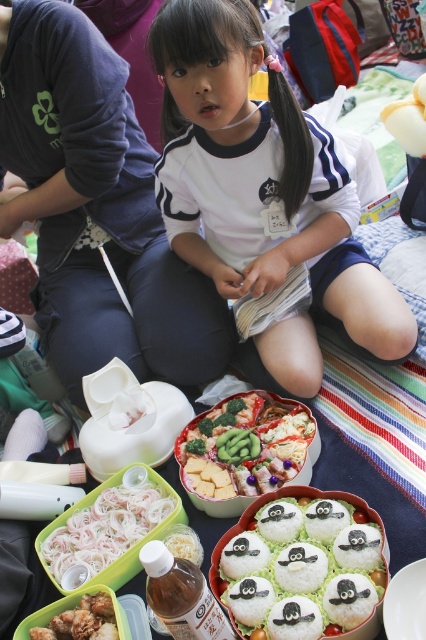
Does white translucent noodles at lower left appear over shiny plastic container at lower left?

Yes, white translucent noodles at lower left is above shiny plastic container at lower left.

Identify the location of white translucent noodles at lower left. Image resolution: width=426 pixels, height=640 pixels. [108, 531].

Is point (55, 556) positioned in front of point (108, 632)?

That is False.

You are a GUI agent. You are given a task and a screenshot of the screen. Output one action in this format:
    pyautogui.click(x=<x>, y=<y>)
    Task: Click on the white translucent noodles at lower left
    
    Given the screenshot: What is the action you would take?
    pyautogui.click(x=108, y=531)

Does vibrant green vegetables at center have a greater width compared to white translucent noodles at lower left?

Yes.

Is vibrant green vegetables at center shorter than white translucent noodles at lower left?

No, vibrant green vegetables at center is not shorter than white translucent noodles at lower left.

I want to click on vibrant green vegetables at center, so click(x=245, y=451).

Locate an element on the screen. This screenshot has height=640, width=426. vibrant green vegetables at center is located at coordinates (245, 451).

The height and width of the screenshot is (640, 426). I want to click on vibrant green vegetables at center, so click(x=245, y=451).